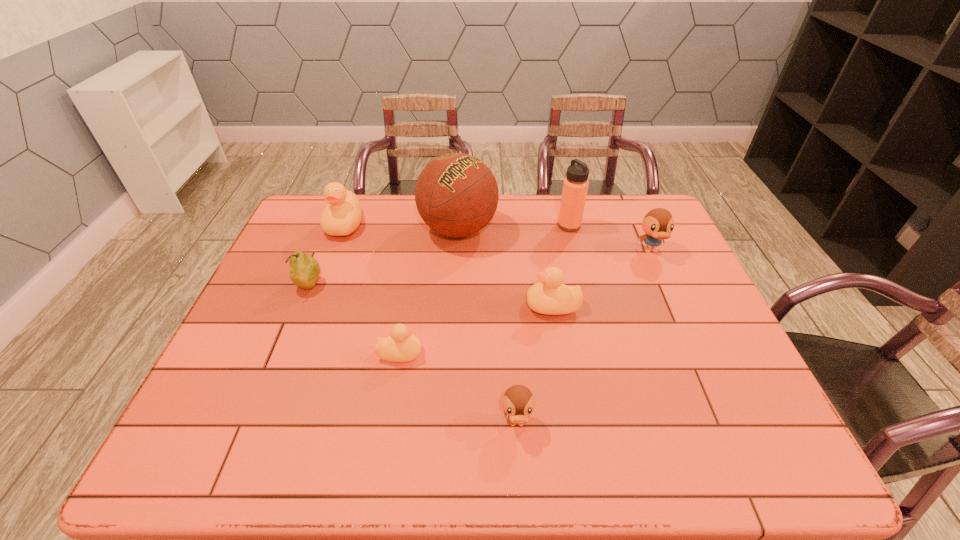
At what (x,y) coordinates should I click in order to perform the action: click on the left blue duck. Please return your answer as a coordinate pair (x, y). This screenshot has height=540, width=960. Looking at the image, I should click on (518, 402).

Locate an element on the screen. The height and width of the screenshot is (540, 960). the seventh farthest object is located at coordinates (402, 346).

Identify the location of the smallest yellow duck. The height and width of the screenshot is (540, 960). (402, 346).

The width and height of the screenshot is (960, 540). Find the location of `vacant space positioned on the right of the basketball`. vacant space positioned on the right of the basketball is located at coordinates (583, 230).

At what (x,y) coordinates should I click in order to perform the action: click on vacant space located 0.100m on the right of the orange thermos bottle. Please return your answer as a coordinate pair (x, y). Looking at the image, I should click on (611, 226).

You are a GUI agent. You are given a task and a screenshot of the screen. Output one action in this format:
    pyautogui.click(x=<x>, y=<y>)
    Task: Click on the vacant position located 0.060m on the face of the biggest yellow duck
    The image size is (960, 540).
    Given the screenshot: What is the action you would take?
    pyautogui.click(x=334, y=254)

This screenshot has height=540, width=960. Identify the location of free space located 0.350m on the front-facing side of the rightmost object. (698, 357).

Where is `vacant space located 0.360m on the face of the third farthest duck`? Image resolution: width=960 pixels, height=540 pixels. vacant space located 0.360m on the face of the third farthest duck is located at coordinates (394, 306).

The image size is (960, 540). What are the coordinates of `free spot located on the face of the third farthest duck` in the screenshot? It's located at (390, 306).

You are a GUI agent. You are given a task and a screenshot of the screen. Output one action in this format:
    pyautogui.click(x=<x>, y=<y>)
    Task: Click on the vacant position located 0.120m on the face of the third farthest duck
    This screenshot has height=540, width=960.
    Given the screenshot: What is the action you would take?
    pyautogui.click(x=482, y=306)